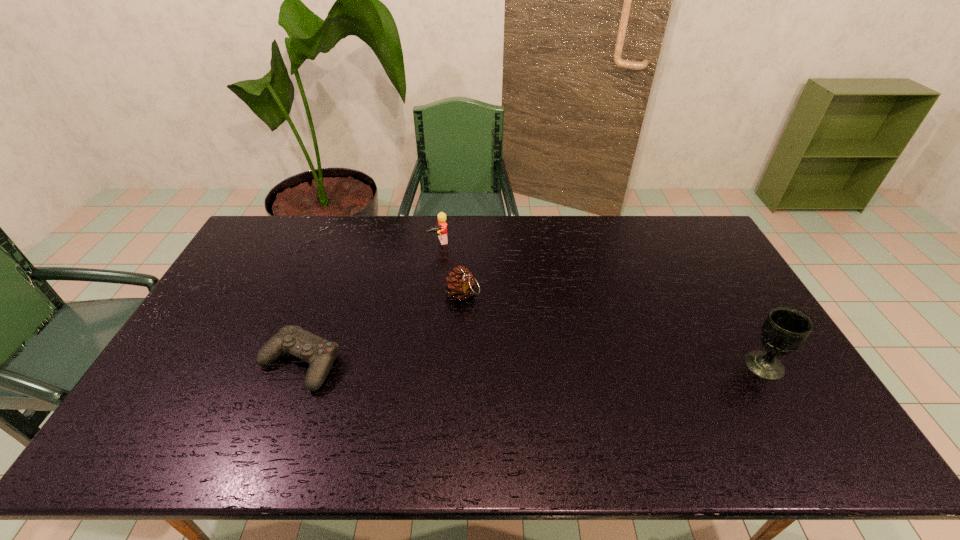
Where is `vacant space located 0.090m in front of the Lego with the accessory visible`? This screenshot has width=960, height=540. vacant space located 0.090m in front of the Lego with the accessory visible is located at coordinates (447, 266).

Where is `blank space located in front of the Lego with the accessory visible`? The image size is (960, 540). blank space located in front of the Lego with the accessory visible is located at coordinates (471, 319).

Find the location of a particular element. The width and height of the screenshot is (960, 540). vacant space located in front of the Lego with the accessory visible is located at coordinates (455, 282).

In order to click on free region located 0.200m with a leaf charm attached to the pinecone in this screenshot , I will do `click(499, 350)`.

Find the location of `vacant region located 0.350m with a leaf charm attached to the pinecone`. vacant region located 0.350m with a leaf charm attached to the pinecone is located at coordinates (526, 392).

Image resolution: width=960 pixels, height=540 pixels. What are the coordinates of `vacant region located with a leaf charm attached to the pinecone` in the screenshot? It's located at (516, 377).

Identify the location of object positioned at the far edge. Image resolution: width=960 pixels, height=540 pixels. (442, 225).

Locate an element on the screen. This screenshot has height=540, width=960. object that is at the near edge is located at coordinates (320, 353).

Where is `object located at the right edge`? The width and height of the screenshot is (960, 540). object located at the right edge is located at coordinates (785, 329).

Locate an element on the screen. Image resolution: width=960 pixels, height=540 pixels. free location at the far edge of the desktop is located at coordinates (419, 227).